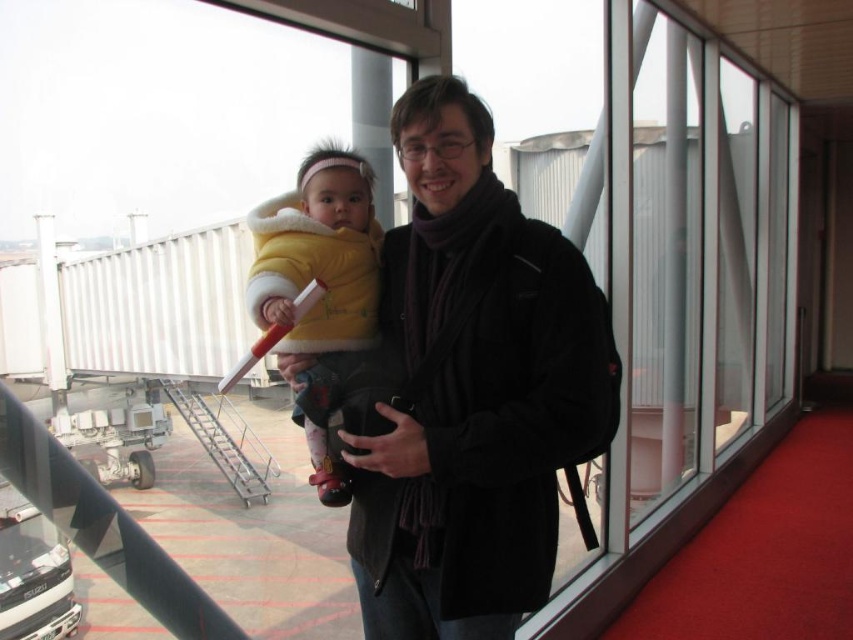
Question: Is matte black jacket at center smaller than yellow fleece jacket at center?

Choices:
 (A) no
 (B) yes

Answer: (A)

Question: From the image, what is the correct spatial relationship of matte black jacket at center in relation to yellow fleece jacket at center?

Choices:
 (A) right
 (B) left

Answer: (A)

Question: Which object appears farthest from the camera in this image?

Choices:
 (A) matte black jacket at center
 (B) yellow fleece jacket at center

Answer: (B)

Question: Observing the image, what is the correct spatial positioning of matte black jacket at center in reference to yellow fleece jacket at center?

Choices:
 (A) left
 (B) right

Answer: (B)